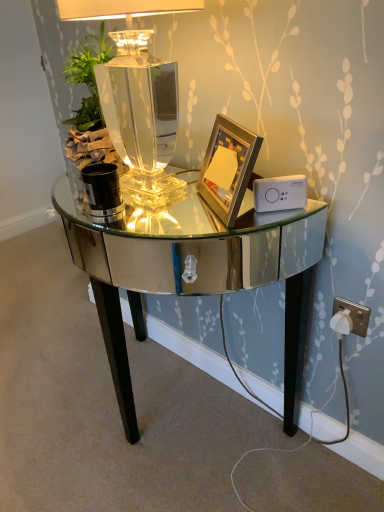
You are a GUI agent. You are given a task and a screenshot of the screen. Output one action in this format:
    pyautogui.click(x=<x>, y=<y>)
    Task: Click on the gold metallic picture frame at center
    The width and height of the screenshot is (384, 512).
    Given the screenshot: What is the action you would take?
    pyautogui.click(x=228, y=168)

Measure the distance between point (254, 195) and camera.

Point (254, 195) and camera are 87.90 centimeters apart.

What do you see at coordinates (280, 193) in the screenshot? Image resolution: width=384 pixels, height=512 pixels. I see `white plastic ipod at right` at bounding box center [280, 193].

The image size is (384, 512). What do you see at coordinates (137, 95) in the screenshot?
I see `clear glass lamp at center` at bounding box center [137, 95].

At what (x,y) coordinates should I click in order to perform the action: click on shiny mirrored desk at center. Please return your answer as a coordinate pair (x, y). Image resolution: width=384 pixels, height=512 pixels. Looking at the image, I should click on (197, 272).

Where is `gold metallic picture frame at center`? gold metallic picture frame at center is located at coordinates (228, 168).

Find the location of `lamp that appears in front of the white plastic ipod at right`. lamp that appears in front of the white plastic ipod at right is located at coordinates (137, 95).

Which is more to the left, white plastic ipod at right or clear glass lamp at center?

From the viewer's perspective, clear glass lamp at center appears more on the left side.

Is point (271, 183) behind point (147, 133)?

That is False.

From the image's perspective, is white plastic ipod at right located above clear glass lamp at center?

Incorrect, from the image's perspective, white plastic ipod at right is lower than clear glass lamp at center.

Is clear glass lamp at center taller or shorter than shiny mirrored desk at center?

clear glass lamp at center is shorter than shiny mirrored desk at center.

From a real-world perspective, is clear glass lamp at center on top of shiny mirrored desk at center?

Yes, from a real-world perspective, clear glass lamp at center is over shiny mirrored desk at center

Looking at their sizes, would you say clear glass lamp at center is wider or thinner than shiny mirrored desk at center?

clear glass lamp at center is thinner than shiny mirrored desk at center.

Could gold metallic picture frame at center be considered to be inside clear glass lamp at center?

Yes, clear glass lamp at center contains gold metallic picture frame at center.

In the scene shown: Which of these two, clear glass lamp at center or gold metallic picture frame at center, is thinner?

With smaller width is gold metallic picture frame at center.

Is clear glass lamp at center turned away from gold metallic picture frame at center?

No, clear glass lamp at center is not facing away from gold metallic picture frame at center.

From the image's perspective, is clear glass lamp at center below gold metallic picture frame at center?

Incorrect, from the image's perspective, clear glass lamp at center is higher than gold metallic picture frame at center.

Considering the positions of objects clear glass lamp at center and white plastic ipod at right in the image provided, who is in front, clear glass lamp at center or white plastic ipod at right?

clear glass lamp at center.

In the scene shown: How much distance is there between clear glass lamp at center and white plastic ipod at right?

clear glass lamp at center is 40.61 centimeters away from white plastic ipod at right.

From a real-world perspective, who is located lower, clear glass lamp at center or white plastic ipod at right?

white plastic ipod at right, from a real-world perspective.

From the image's perspective, would you say clear glass lamp at center is shown under white plastic ipod at right?

No, from the image's perspective, clear glass lamp at center is not beneath white plastic ipod at right.

Would you say gold metallic picture frame at center is to the left or to the right of clear glass lamp at center in the picture?

gold metallic picture frame at center is to the right of clear glass lamp at center.

Considering the sizes of objects gold metallic picture frame at center and clear glass lamp at center in the image provided, who is taller, gold metallic picture frame at center or clear glass lamp at center?

clear glass lamp at center is taller.

Does gold metallic picture frame at center turn towards clear glass lamp at center?

Yes.

Are gold metallic picture frame at center and clear glass lamp at center located far from each other?

No, gold metallic picture frame at center is in close proximity to clear glass lamp at center.

Considering the relative positions of shiny mirrored desk at center and clear glass lamp at center in the image provided, is shiny mirrored desk at center to the left or to the right of clear glass lamp at center?

In the image, shiny mirrored desk at center appears on the left side of clear glass lamp at center.

Is shiny mirrored desk at center smaller than clear glass lamp at center?

No, shiny mirrored desk at center is not smaller than clear glass lamp at center.

From the picture: Is shiny mirrored desk at center not within clear glass lamp at center?

shiny mirrored desk at center is positioned outside clear glass lamp at center.

Is white plastic ipod at right with gold metallic picture frame at center?

Yes, the surface of white plastic ipod at right is in contact with gold metallic picture frame at center.

Is white plastic ipod at right in front of or behind gold metallic picture frame at center in the image?

white plastic ipod at right is positioned farther from the viewer than gold metallic picture frame at center.

Considering the points (290, 207) and (218, 200), which point is in front, point (290, 207) or point (218, 200)?

The point (290, 207) is closer.

Does white plastic ipod at right have a greater width compared to gold metallic picture frame at center?

Incorrect, the width of white plastic ipod at right does not surpass that of gold metallic picture frame at center.

Image resolution: width=384 pixels, height=512 pixels. In the image, there is a clear glass lamp at center. Identify the location of ipod below it (from a real-world perspective). (280, 193).

The width and height of the screenshot is (384, 512). What are the coordinates of `lamp above the shiny mirrored desk at center (from a real-world perspective)` in the screenshot? It's located at (137, 95).

Considering their positions, is shiny mirrored desk at center positioned further to white plastic ipod at right than gold metallic picture frame at center?

shiny mirrored desk at center lies further to white plastic ipod at right than the other object.

Based on their spatial positions, is white plastic ipod at right or clear glass lamp at center further from shiny mirrored desk at center?

Among the two, white plastic ipod at right is located further to shiny mirrored desk at center.

Based on their spatial positions, is shiny mirrored desk at center or white plastic ipod at right further from clear glass lamp at center?

shiny mirrored desk at center lies further to clear glass lamp at center than the other object.

Looking at the image, which one is located closer to gold metallic picture frame at center, shiny mirrored desk at center or clear glass lamp at center?

Based on the image, clear glass lamp at center appears to be nearer to gold metallic picture frame at center.

When comparing their distances from gold metallic picture frame at center, does clear glass lamp at center or shiny mirrored desk at center seem closer?

Based on the image, clear glass lamp at center appears to be nearer to gold metallic picture frame at center.

When comparing their distances from clear glass lamp at center, does white plastic ipod at right or gold metallic picture frame at center seem closer?

gold metallic picture frame at center is positioned closer to the anchor clear glass lamp at center.

Estimate the real-world distances between objects in this image. Which object is closer to clear glass lamp at center, gold metallic picture frame at center or shiny mirrored desk at center?

Among the two, gold metallic picture frame at center is located nearer to clear glass lamp at center.

Estimate the real-world distances between objects in this image. Which object is closer to white plastic ipod at right, gold metallic picture frame at center or clear glass lamp at center?

Among the two, gold metallic picture frame at center is located nearer to white plastic ipod at right.

Where is `picture frame between clear glass lamp at center and white plastic ipod at right in the horizontal direction`? picture frame between clear glass lamp at center and white plastic ipod at right in the horizontal direction is located at coordinates (228, 168).

Find the location of a particular element. ipod between clear glass lamp at center and shiny mirrored desk at center from top to bottom is located at coordinates (280, 193).

At what (x,y) coordinates should I click in order to perform the action: click on picture frame between clear glass lamp at center and shiny mirrored desk at center from top to bottom. Please return your answer as a coordinate pair (x, y). The height and width of the screenshot is (512, 384). Looking at the image, I should click on (228, 168).

Where is `ipod between gold metallic picture frame at center and shiny mirrored desk at center from top to bottom`? The width and height of the screenshot is (384, 512). ipod between gold metallic picture frame at center and shiny mirrored desk at center from top to bottom is located at coordinates (280, 193).